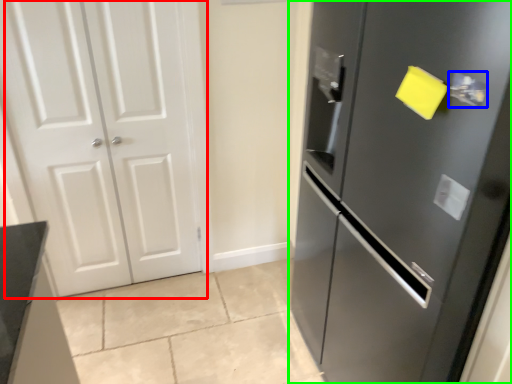
Question: Considering the real-world distances, which object is closest to door (highlighted by a red box)? door handle (highlighted by a blue box) or door (highlighted by a green box).

Choices:
 (A) door handle
 (B) door

Answer: (B)